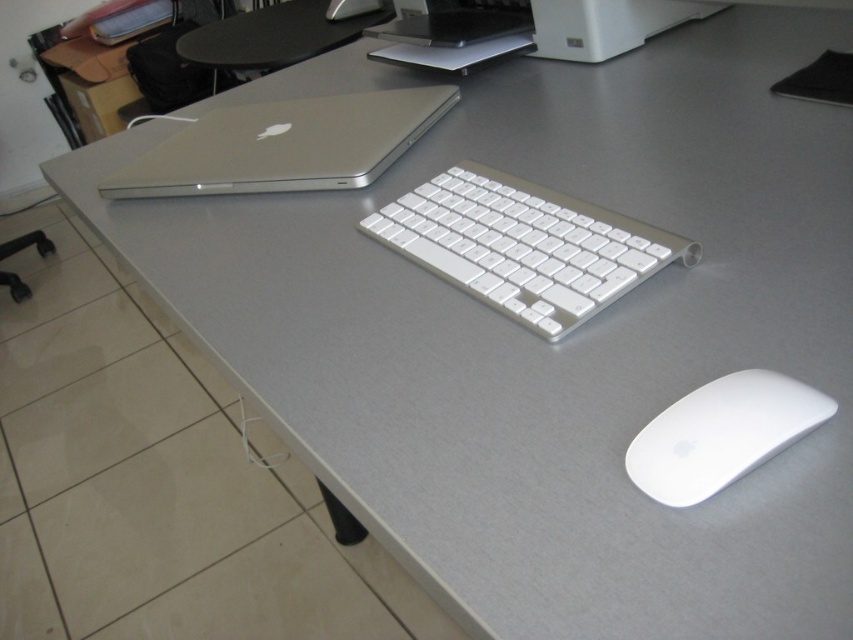
You need to place both the silver metallic laptop at upper left and the white matte mouse at lower right into a storage box that can only fit items up to the size of the larger object. Which object determines the minimum required size for the box?

The silver metallic laptop at upper left is larger in size than the white matte mouse at lower right, so the box must be at least as large as the silver metallic laptop at upper left to accommodate both items.

You are setting up a new desk and want to arrange your devices. You have a white plastic keyboard at center and a white matte mouse at lower right. Which device is taller?

The white plastic keyboard at center is taller than the white matte mouse at lower right according to the description.

Where is the silver metallic laptop at upper left located in the image?

The silver metallic laptop at upper left is located at point (285, 145) in the image.